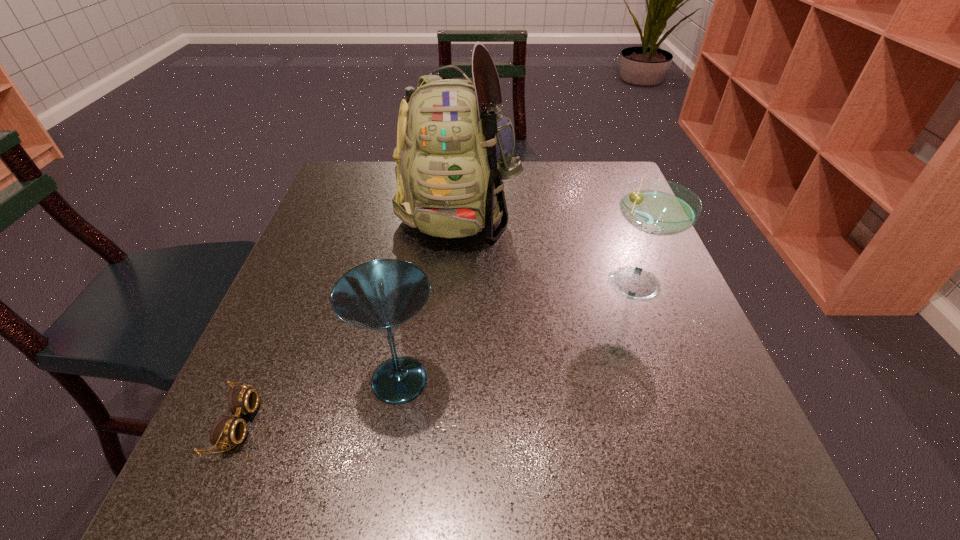
Identify the location of backpack. Image resolution: width=960 pixels, height=540 pixels. (454, 150).

In order to click on the farther martini in this screenshot , I will do `click(656, 207)`.

The height and width of the screenshot is (540, 960). Find the location of `the right martini`. the right martini is located at coordinates (656, 207).

The height and width of the screenshot is (540, 960). In order to click on the left martini in this screenshot , I will do `click(381, 295)`.

In order to click on the shortest object in this screenshot , I will do `click(226, 431)`.

Locate an element on the screen. The height and width of the screenshot is (540, 960). goggles is located at coordinates (226, 431).

Find the location of a particular element. vacant region located 0.220m on the front-facing side of the backpack is located at coordinates (451, 328).

Locate an element on the screen. Image resolution: width=960 pixels, height=540 pixels. vacant area situated on the left of the right martini is located at coordinates (563, 279).

The image size is (960, 540). I want to click on vacant region located 0.050m on the back of the nearer martini, so click(408, 327).

Find the location of a particular element. The image size is (960, 540). free space located 0.100m through the lenses of the goggles is located at coordinates (317, 424).